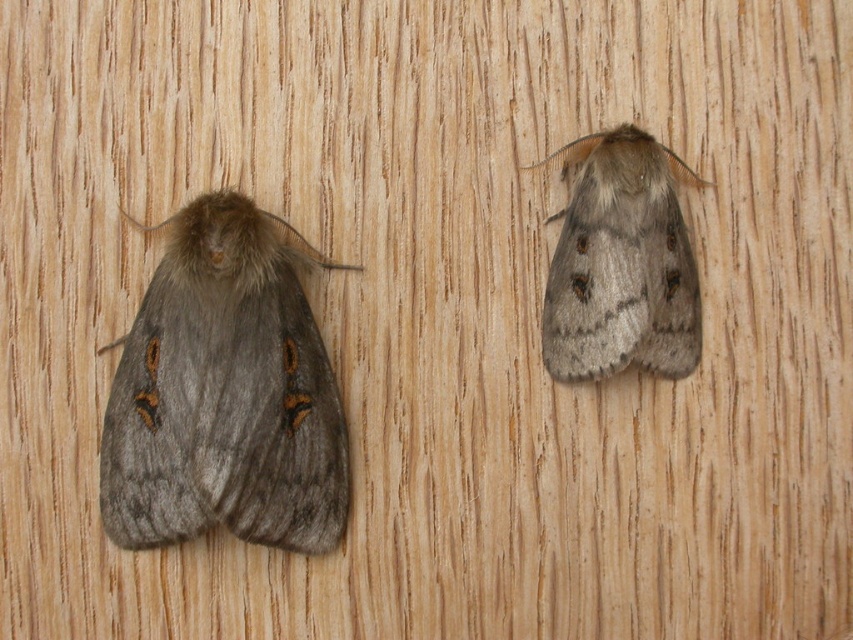
In the scene shown: Between fuzzy gray moth at left and fuzzy gray moth at right, which one has more height?

Standing taller between the two is fuzzy gray moth at left.

Who is lower down, fuzzy gray moth at left or fuzzy gray moth at right?

fuzzy gray moth at left

Which is behind, point (228, 417) or point (595, 134)?

The point (595, 134) is more distant.

Find the location of a particular element. The image size is (853, 640). fuzzy gray moth at left is located at coordinates (225, 394).